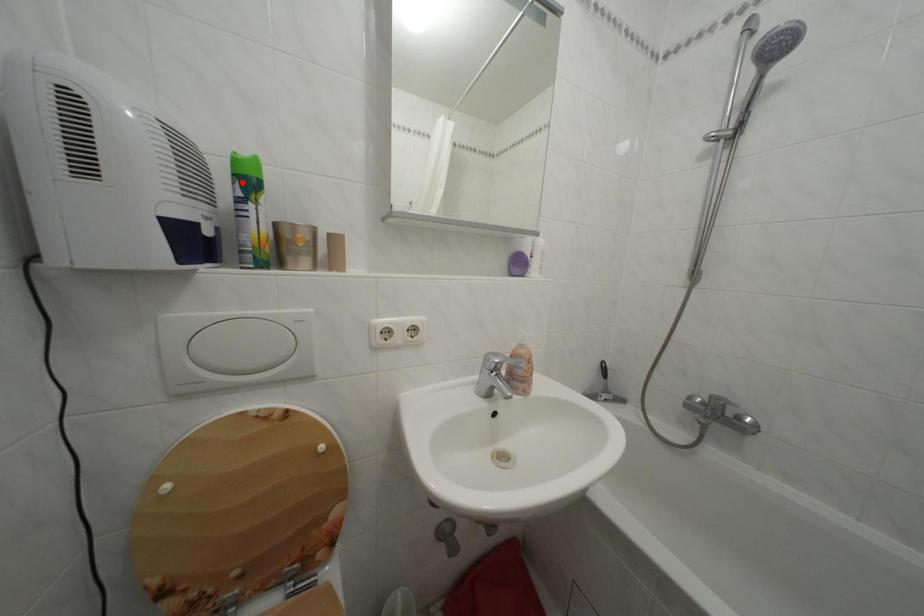
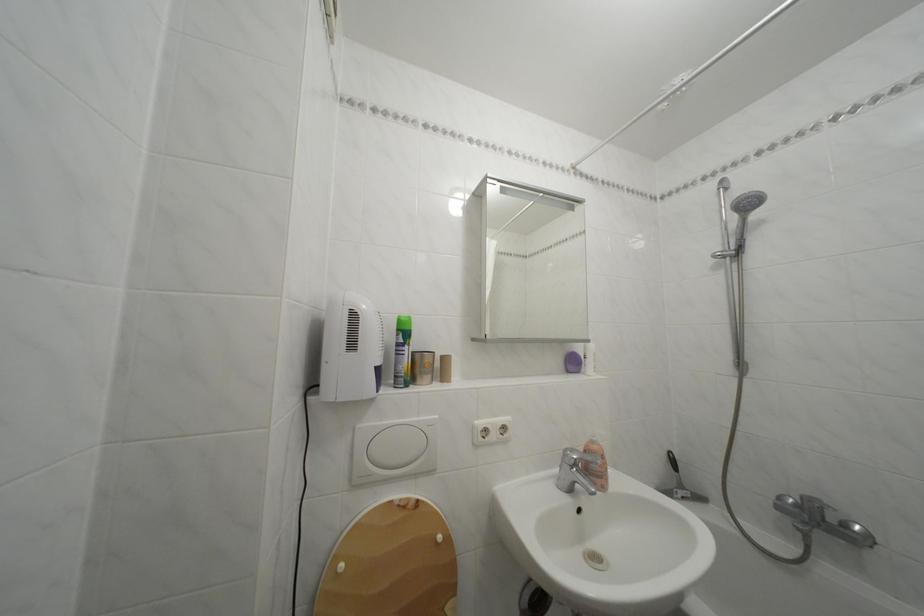
Locate, in the second image, the point that corresponds to the highlighted location in the first image.

(407, 336)